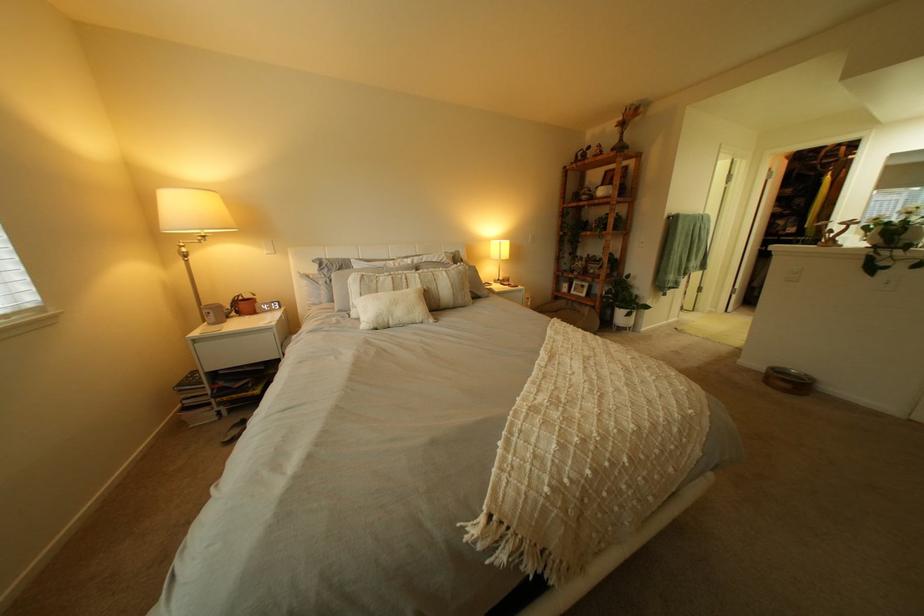
Find where to lift the white plant pot. Please return your answer as a coordinate pair (x, y).

(622, 300)